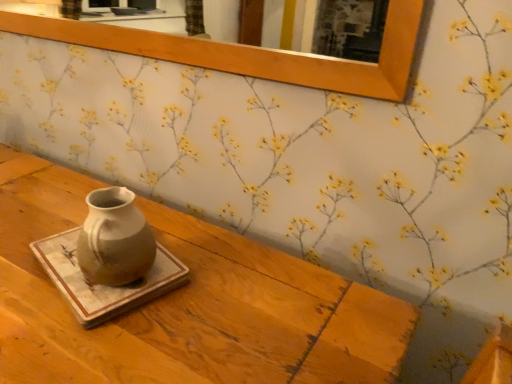
Describe the element at coordinates (102, 285) in the screenshot. This screenshot has height=384, width=512. I see `marble tray at center` at that location.

What do you see at coordinates (252, 52) in the screenshot? This screenshot has height=384, width=512. I see `wooden frame at upper center` at bounding box center [252, 52].

You are a GUI agent. You are given a task and a screenshot of the screen. Output one action in this format:
    pyautogui.click(x=<x>, y=<y>)
    Task: Click on the marble tray at center
    Image resolution: width=512 pixels, height=384 pixels.
    Given the screenshot: What is the action you would take?
    pyautogui.click(x=102, y=285)

Considering the sizes of objects matte ceramic vase at center and wooden frame at upper center in the image provided, who is smaller, matte ceramic vase at center or wooden frame at upper center?

Smaller between the two is wooden frame at upper center.

Would you say matte ceramic vase at center is inside or outside wooden frame at upper center?

matte ceramic vase at center is spatially situated outside wooden frame at upper center.

Considering the sizes of matte ceramic vase at center and wooden frame at upper center in the image, is matte ceramic vase at center wider or thinner than wooden frame at upper center?

matte ceramic vase at center is wider than wooden frame at upper center.

Is matte ceramic vase at center turned away from wooden frame at upper center?

That's not correct — matte ceramic vase at center is not looking away from wooden frame at upper center.

Is matte ceramic vase at center looking in the opposite direction of marble tray at center?

No.

Is matte ceramic vase at center surrounding marble tray at center?

No.

Between matte ceramic vase at center and marble tray at center, which one has smaller width?

marble tray at center.

How far apart are wooden frame at upper center and marble tray at center?

wooden frame at upper center is 28.36 inches away from marble tray at center.

Is point (162, 57) closer to viewer compared to point (48, 254)?

No, (162, 57) is behind (48, 254).

From a real-world perspective, is wooden frame at upper center under marble tray at center?

No.

Considering the sizes of objects wooden frame at upper center and marble tray at center in the image provided, who is smaller, wooden frame at upper center or marble tray at center?

marble tray at center.

Which is closer, (379, 62) or (19, 313)?

Positioned in front is point (19, 313).

Choose the correct answer: Is wooden frame at upper center inside matte ceramic vase at center or outside it?

wooden frame at upper center is not inside matte ceramic vase at center, it's outside.

Considering the relative positions of wooden frame at upper center and matte ceramic vase at center in the image provided, is wooden frame at upper center to the left or to the right of matte ceramic vase at center?

Based on their positions, wooden frame at upper center is located to the left of matte ceramic vase at center.

From the image's perspective, is wooden frame at upper center above or below matte ceramic vase at center?

Clearly, from the image's perspective, wooden frame at upper center is above matte ceramic vase at center.

From a real-world perspective, is marble tray at center over wooden frame at upper center?

No.

Which of these two, marble tray at center or wooden frame at upper center, stands taller?

With more height is wooden frame at upper center.

From the picture: From the image's perspective, who appears lower, marble tray at center or wooden frame at upper center?

marble tray at center, from the image's perspective.

Looking at this image, from a real-world perspective, which object rests below the other?

matte ceramic vase at center.

Is marble tray at center placed right next to matte ceramic vase at center?

marble tray at center and matte ceramic vase at center are clearly separated.

From the picture: From the image's perspective, is marble tray at center on matte ceramic vase at center?

Correct, marble tray at center appears higher than matte ceramic vase at center in the image.

Based on the photo, is marble tray at center positioned with its back to matte ceramic vase at center?

No, marble tray at center is not facing the opposite direction of matte ceramic vase at center.

At what (x,y) coordinates should I click in order to perform the action: click on table that appears in front of the wooden frame at upper center. Please return your answer as a coordinate pair (x, y). This screenshot has height=384, width=512. Looking at the image, I should click on (185, 304).

The image size is (512, 384). There is a matte ceramic vase at center. What are the coordinates of `tray above it (from a real-world perspective)` in the screenshot? It's located at (102, 285).

Based on the photo, considering their positions, is matte ceramic vase at center positioned further to wooden frame at upper center than marble tray at center?

marble tray at center lies further to wooden frame at upper center than the other object.

Which object lies nearer to the anchor point matte ceramic vase at center, wooden frame at upper center or marble tray at center?

marble tray at center is closer to matte ceramic vase at center.

Considering their positions, is matte ceramic vase at center positioned closer to marble tray at center than wooden frame at upper center?

The object closer to marble tray at center is matte ceramic vase at center.

Estimate the real-world distances between objects in this image. Which object is closer to matte ceramic vase at center, marble tray at center or wooden frame at upper center?

The object closer to matte ceramic vase at center is marble tray at center.

Considering their positions, is wooden frame at upper center positioned further to marble tray at center than matte ceramic vase at center?

wooden frame at upper center is positioned further to the anchor marble tray at center.

Considering their positions, is marble tray at center positioned closer to wooden frame at upper center than matte ceramic vase at center?

matte ceramic vase at center lies closer to wooden frame at upper center than the other object.

This screenshot has width=512, height=384. What are the coordinates of `tray between wooden frame at upper center and matte ceramic vase at center in the up-down direction` in the screenshot? It's located at (102, 285).